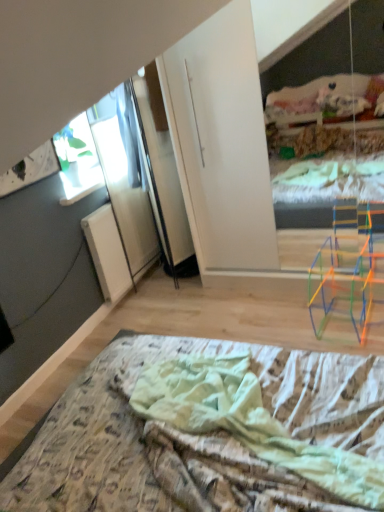
Question: Is transparent glass window at upper left completely or partially outside of printed fabric bed at lower center?

Choices:
 (A) yes
 (B) no

Answer: (A)

Question: Is transparent glass window at upper left positioned far away from printed fabric bed at lower center?

Choices:
 (A) yes
 (B) no

Answer: (A)

Question: Is transparent glass window at upper left looking in the opposite direction of printed fabric bed at lower center?

Choices:
 (A) no
 (B) yes

Answer: (A)

Question: Considering the relative sizes of transparent glass window at upper left and printed fabric bed at lower center in the image provided, is transparent glass window at upper left wider than printed fabric bed at lower center?

Choices:
 (A) no
 (B) yes

Answer: (A)

Question: Does transparent glass window at upper left have a larger size compared to printed fabric bed at lower center?

Choices:
 (A) no
 (B) yes

Answer: (A)

Question: Is transparent glass window at upper left facing towards printed fabric bed at lower center?

Choices:
 (A) no
 (B) yes

Answer: (A)

Question: Is printed fabric bed at lower center bigger than transparent glass window at upper left?

Choices:
 (A) no
 (B) yes

Answer: (B)

Question: Is printed fabric bed at lower center positioned before transparent glass window at upper left?

Choices:
 (A) no
 (B) yes

Answer: (B)

Question: Can you confirm if printed fabric bed at lower center is shorter than transparent glass window at upper left?

Choices:
 (A) yes
 (B) no

Answer: (A)

Question: Is printed fabric bed at lower center wider than transparent glass window at upper left?

Choices:
 (A) yes
 (B) no

Answer: (A)

Question: From the image's perspective, would you say printed fabric bed at lower center is positioned over transparent glass window at upper left?

Choices:
 (A) yes
 (B) no

Answer: (B)

Question: Considering the relative sizes of printed fabric bed at lower center and transparent glass window at upper left in the image provided, is printed fabric bed at lower center taller than transparent glass window at upper left?

Choices:
 (A) yes
 (B) no

Answer: (B)

Question: Would you say transparent glass window at upper left is to the left or to the right of printed fabric bed at lower center in the picture?

Choices:
 (A) left
 (B) right

Answer: (A)